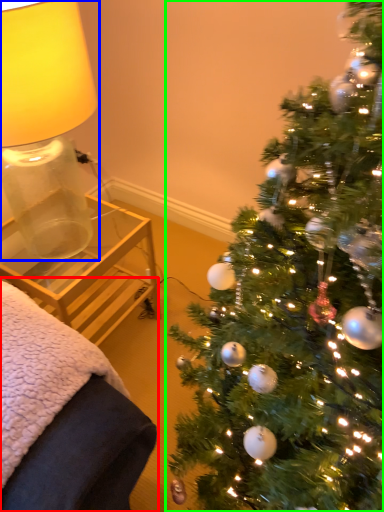
Question: Which object is the farthest from furniture (highlighted by a red box)? Choose among these: table lamp (highlighted by a blue box) or christmas tree (highlighted by a green box).

Choices:
 (A) table lamp
 (B) christmas tree

Answer: (A)